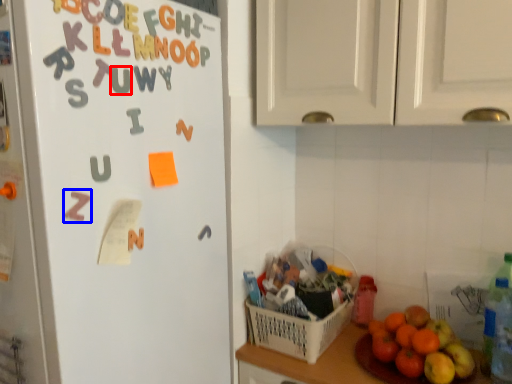
Question: Which object appears closest to the camera in this image, alphabet (highlighted by a red box) or alphabet (highlighted by a blue box)?

Choices:
 (A) alphabet
 (B) alphabet

Answer: (B)